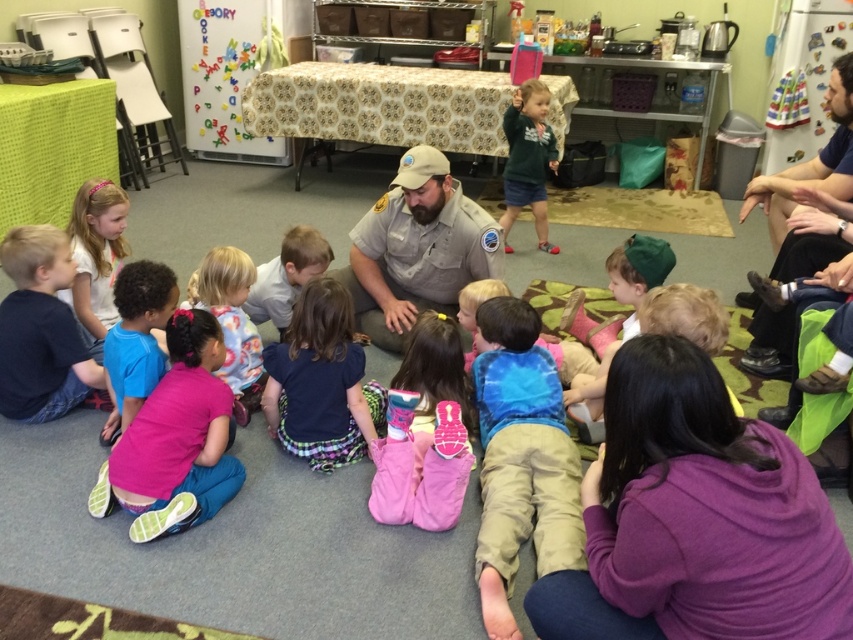
From the picture: You are a photographer standing in the center of the room. You want to take a photo of the scene so that the pink fabric dress at lower left is centered in the frame. Based on its 2D location, where should you position your camera relative to the room?

The pink fabric dress at lower left is located at point 0.505 on the x axis and 0.272 on the y axis. To center it in the frame, position the camera so that the dress is at the center coordinates of the image plane.

Based on the photo, you are a photographer trying to capture a candid shot of the white matte shirt at center without the subject noticing. Since the dark blue fabric pants at lower left is blocking your view, can you estimate if the pants are bigger than the shirt?

The dark blue fabric pants at lower left is larger in size than the white matte shirt at center, so yes, the pants are bigger and might be blocking the view.

You are a photographer trying to capture a candid shot of the scene. You notice the dark blue fabric pants at lower left and the white matte shirt at center. Which object should you focus on to ensure it appears larger in your photo?

The white matte shirt at center has a greater height than the dark blue fabric pants at lower left, so focusing on it would make it appear larger in the photo.